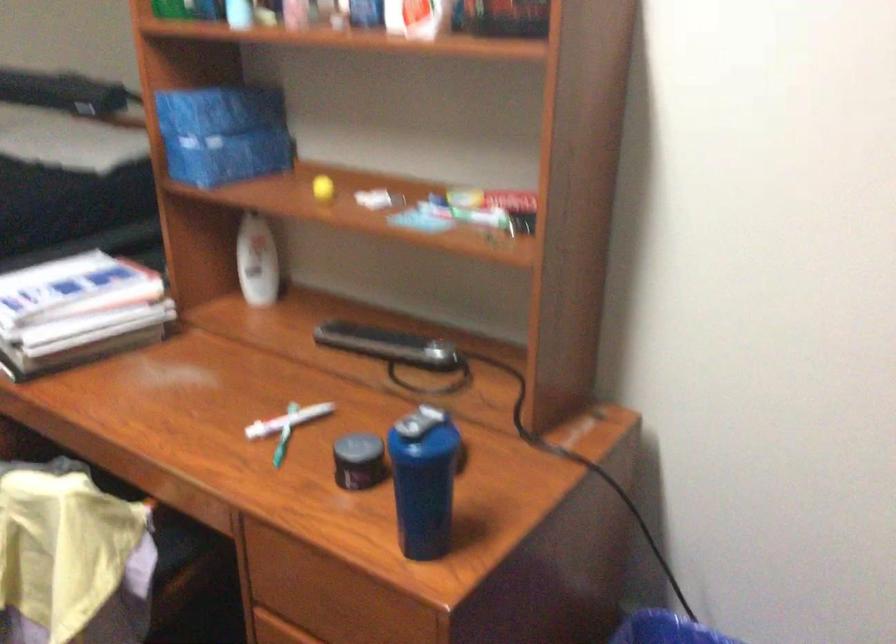
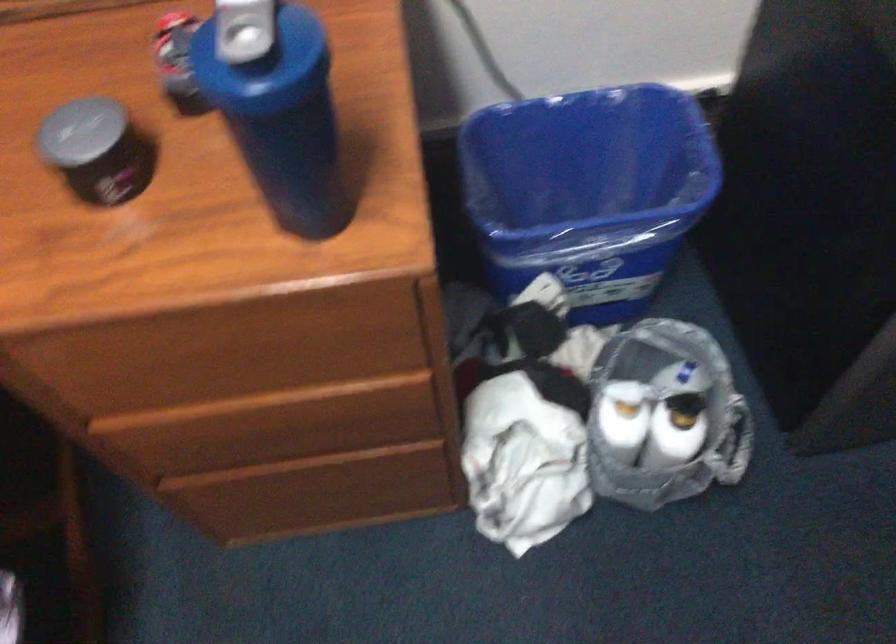
Based on the continuous images, in which direction is the camera rotating?

The camera rotated toward right-down.